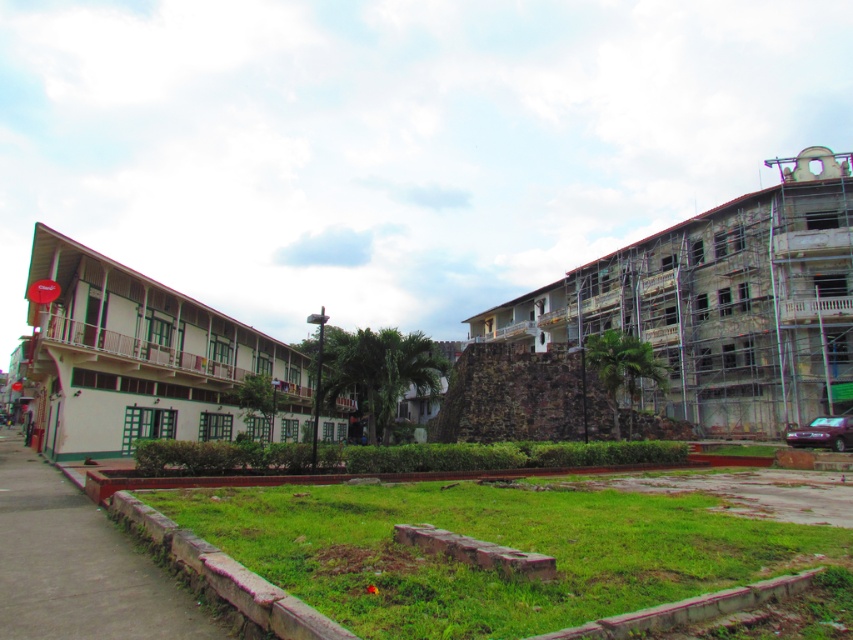
Which is in front, point (809, 356) or point (47, 237)?

Point (47, 237) is in front.

Is stone textured wall at right smaller than white matte building at left?

Indeed, stone textured wall at right has a smaller size compared to white matte building at left.

What do you see at coordinates (721, 304) in the screenshot?
I see `stone textured wall at right` at bounding box center [721, 304].

Find the location of `stone textured wall at right`. stone textured wall at right is located at coordinates (721, 304).

Does green grass at center have a smaller size compared to concrete sidewalk at lower left?

Yes.

Is green grass at center positioned behind concrete sidewalk at lower left?

No, green grass at center is closer to the viewer.

You are a GUI agent. You are given a task and a screenshot of the screen. Output one action in this format:
    pyautogui.click(x=<x>, y=<y>)
    Task: Click on the green grass at center
    The image size is (853, 640).
    Given the screenshot: What is the action you would take?
    pyautogui.click(x=496, y=541)

Where is `green grass at center`? The height and width of the screenshot is (640, 853). green grass at center is located at coordinates (496, 541).

Which is behind, point (775, 529) or point (65, 348)?

Positioned behind is point (65, 348).

Can you confirm if green grass at center is positioned to the left of white matte building at left?

Incorrect, green grass at center is not on the left side of white matte building at left.

Between point (326, 577) and point (242, 337), which one is positioned in front?

Point (326, 577)

Locate an element on the screen. This screenshot has width=853, height=640. green grass at center is located at coordinates (496, 541).